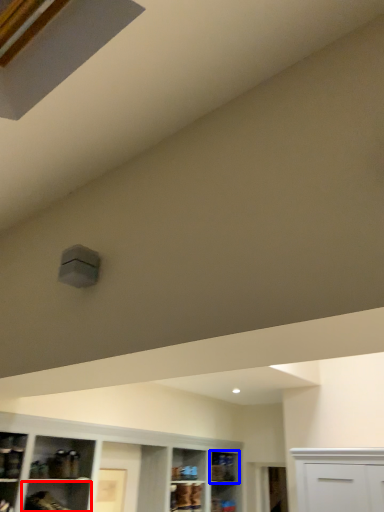
Question: Among these objects, which one is farthest to the camera, shelf (highlighted by a red box) or shelf (highlighted by a blue box)?

Choices:
 (A) shelf
 (B) shelf

Answer: (B)